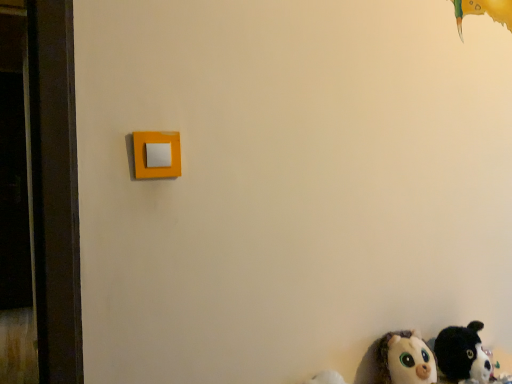
Question: Is white plush toy at lower right, which appears as the second toy when viewed from the right, smaller than fluffy plush cat at lower right, which is the 2th toy in left-to-right order?

Choices:
 (A) no
 (B) yes

Answer: (B)

Question: Considering the relative sizes of white plush toy at lower right, which appears as the first toy when viewed from the left, and fluffy plush cat at lower right, which is the 2th toy in left-to-right order, in the image provided, is white plush toy at lower right, which appears as the first toy when viewed from the left, bigger than fluffy plush cat at lower right, which is the 2th toy in left-to-right order,?

Choices:
 (A) no
 (B) yes

Answer: (A)

Question: Is fluffy plush cat at lower right, which is the first toy in right-to-left order, at the back of white plush toy at lower right, which appears as the first toy when viewed from the left?

Choices:
 (A) no
 (B) yes

Answer: (A)

Question: Is white plush toy at lower right, which appears as the first toy when viewed from the left, further to camera compared to fluffy plush cat at lower right, which is the 2th toy in left-to-right order?

Choices:
 (A) yes
 (B) no

Answer: (B)

Question: Does white plush toy at lower right, which appears as the second toy when viewed from the right, have a lesser width compared to fluffy plush cat at lower right, which is the first toy in right-to-left order?

Choices:
 (A) yes
 (B) no

Answer: (A)

Question: Is white plush toy at lower right, which appears as the first toy when viewed from the left, facing towards fluffy plush cat at lower right, which is the 2th toy in left-to-right order?

Choices:
 (A) no
 (B) yes

Answer: (A)

Question: Is fluffy plush cat at lower right, which is the 2th toy in left-to-right order, smaller than white plush toy at lower right, which appears as the first toy when viewed from the left?

Choices:
 (A) yes
 (B) no

Answer: (B)

Question: From the image's perspective, does fluffy plush cat at lower right, which is the 2th toy in left-to-right order, appear higher than white plush toy at lower right, which appears as the second toy when viewed from the right?

Choices:
 (A) yes
 (B) no

Answer: (A)

Question: Can you confirm if fluffy plush cat at lower right, which is the first toy in right-to-left order, is bigger than white plush toy at lower right, which appears as the first toy when viewed from the left?

Choices:
 (A) no
 (B) yes

Answer: (B)

Question: Is the depth of fluffy plush cat at lower right, which is the 2th toy in left-to-right order, greater than that of white plush toy at lower right, which appears as the first toy when viewed from the left?

Choices:
 (A) no
 (B) yes

Answer: (B)

Question: Considering the relative positions of fluffy plush cat at lower right, which is the 2th toy in left-to-right order, and white plush toy at lower right, which appears as the second toy when viewed from the right, in the image provided, is fluffy plush cat at lower right, which is the 2th toy in left-to-right order, in front of white plush toy at lower right, which appears as the second toy when viewed from the right,?

Choices:
 (A) yes
 (B) no

Answer: (B)

Question: Is fluffy plush cat at lower right, which is the first toy in right-to-left order, surrounding white plush toy at lower right, which appears as the second toy when viewed from the right?

Choices:
 (A) yes
 (B) no

Answer: (B)

Question: Is fluffy plush cat at lower right, which is the 2th toy in left-to-right order, bigger or smaller than white plush toy at lower right, which appears as the first toy when viewed from the left?

Choices:
 (A) big
 (B) small

Answer: (A)